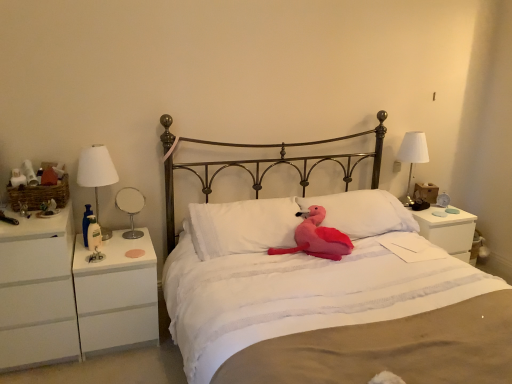
Question: From the image's perspective, is white glossy table lamp at left over white matte nightstand at right, the 1th nightstand positioned from the right?

Choices:
 (A) no
 (B) yes

Answer: (B)

Question: Is the surface of white glossy table lamp at left in direct contact with white matte nightstand at right, the 1th nightstand positioned from the right?

Choices:
 (A) no
 (B) yes

Answer: (A)

Question: Considering the relative positions of white glossy table lamp at left and white matte nightstand at right, acting as the 3th nightstand starting from the left, in the image provided, is white glossy table lamp at left to the right of white matte nightstand at right, acting as the 3th nightstand starting from the left, from the viewer's perspective?

Choices:
 (A) yes
 (B) no

Answer: (B)

Question: Is white glossy table lamp at left not inside white matte nightstand at right, the 1th nightstand positioned from the right?

Choices:
 (A) no
 (B) yes

Answer: (B)

Question: Is white glossy table lamp at left in front of white matte nightstand at right, the 1th nightstand positioned from the right?

Choices:
 (A) no
 (B) yes

Answer: (B)

Question: Is white glossy table lamp at left oriented towards white matte nightstand at right, the 1th nightstand positioned from the right?

Choices:
 (A) no
 (B) yes

Answer: (A)

Question: Is white fabric lampshade at right, placed as the 1th bedside lamp when sorted from back to front, positioned far away from fluffy pink plush at center?

Choices:
 (A) no
 (B) yes

Answer: (B)

Question: Does white fabric lampshade at right, which appears as the first bedside lamp when viewed from the right, have a larger size compared to fluffy pink plush at center?

Choices:
 (A) yes
 (B) no

Answer: (B)

Question: Is white fabric lampshade at right, which is the second bedside lamp in left-to-right order, at the right side of fluffy pink plush at center?

Choices:
 (A) yes
 (B) no

Answer: (A)

Question: Is the position of white fabric lampshade at right, which is the second bedside lamp in left-to-right order, more distant than that of fluffy pink plush at center?

Choices:
 (A) yes
 (B) no

Answer: (A)

Question: Is white fabric lampshade at right, placed as the 1th bedside lamp when sorted from back to front, oriented towards fluffy pink plush at center?

Choices:
 (A) no
 (B) yes

Answer: (A)

Question: Considering the relative sizes of white fabric lampshade at right, arranged as the second bedside lamp when viewed from the front, and fluffy pink plush at center in the image provided, is white fabric lampshade at right, arranged as the second bedside lamp when viewed from the front, thinner than fluffy pink plush at center?

Choices:
 (A) yes
 (B) no

Answer: (A)

Question: Can you confirm if white soft pillow at center, positioned as the second pillow in left-to-right order, is bigger than pink plush toy at center?

Choices:
 (A) yes
 (B) no

Answer: (B)